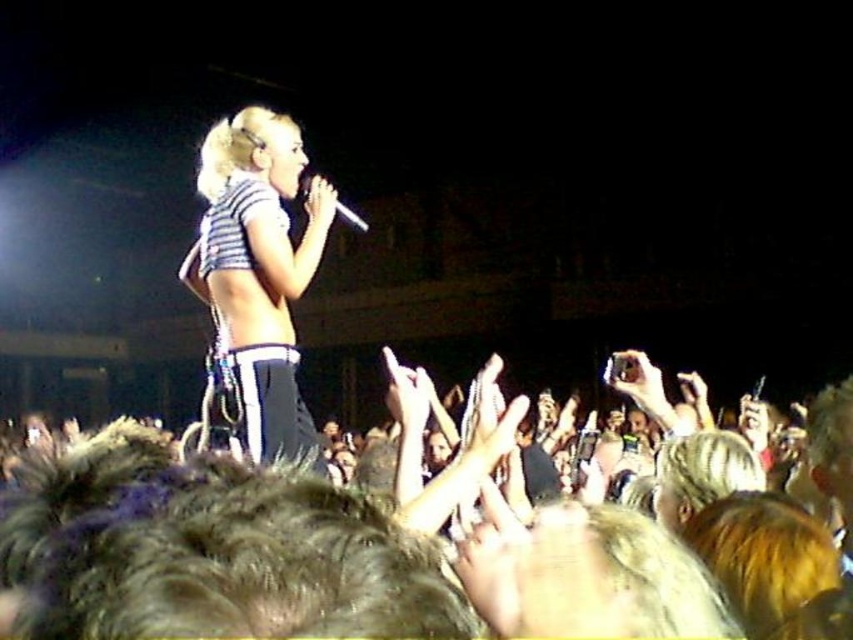
Can you confirm if striped fabric top at center is positioned to the left of shiny metallic microphone at center?

No, striped fabric top at center is not to the left of shiny metallic microphone at center.

You are a GUI agent. You are given a task and a screenshot of the screen. Output one action in this format:
    pyautogui.click(x=<x>, y=<y>)
    Task: Click on the striped fabric top at center
    Image resolution: width=853 pixels, height=640 pixels.
    Given the screenshot: What is the action you would take?
    pyautogui.click(x=258, y=273)

Is striped fabric top at center positioned at the back of striped fabric bikini top at center?

No.

Which is behind, point (219, 323) or point (276, 193)?

The point (276, 193) is more distant.

Does point (257, 339) lie in front of point (225, 257)?

Yes.

Where is `striped fabric top at center`? This screenshot has width=853, height=640. striped fabric top at center is located at coordinates (258, 273).

In the scene shown: Does striped fabric bikini top at center appear over shiny metallic microphone at center?

No.

Between striped fabric bikini top at center and shiny metallic microphone at center, which one has more height?

With more height is shiny metallic microphone at center.

This screenshot has height=640, width=853. What do you see at coordinates (235, 225) in the screenshot?
I see `striped fabric bikini top at center` at bounding box center [235, 225].

Locate an element on the screen. This screenshot has width=853, height=640. striped fabric bikini top at center is located at coordinates (235, 225).